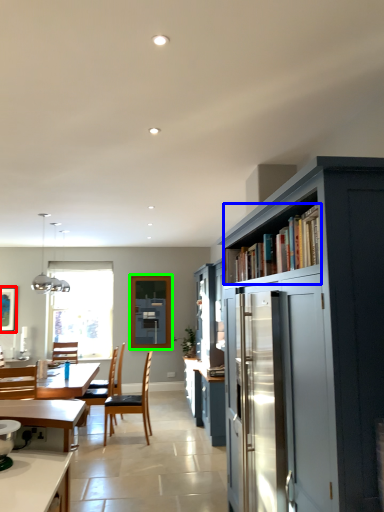
Question: Considering the real-world distances, which object is farthest from picture frame (highlighted by a red box)? shelf (highlighted by a blue box) or window screen (highlighted by a green box)?

Choices:
 (A) shelf
 (B) window screen

Answer: (A)